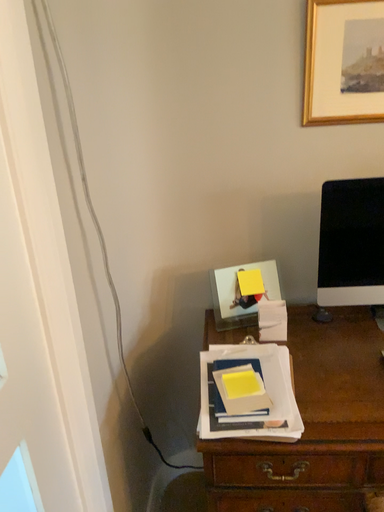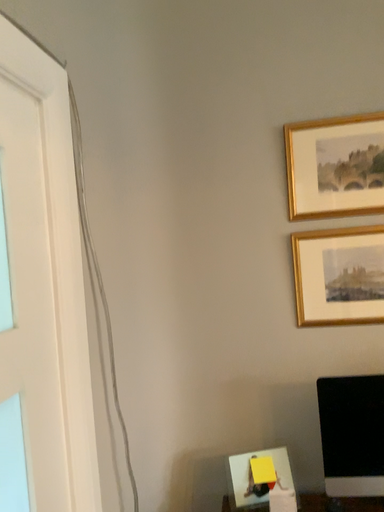
Question: How did the camera likely rotate when shooting the video?

Choices:
 (A) rotated upward
 (B) rotated downward

Answer: (A)